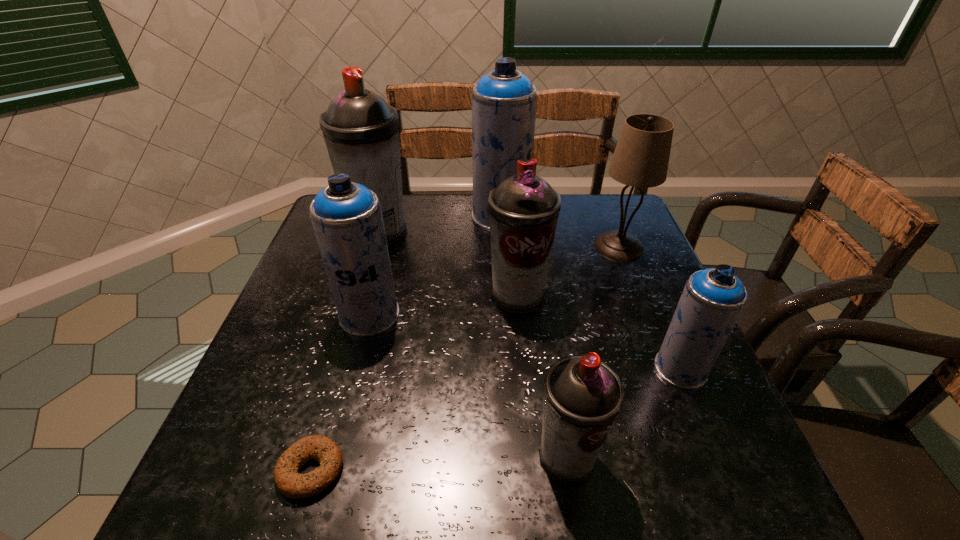
I want to click on object that is at the far right corner, so click(641, 157).

You are a GUI agent. You are given a task and a screenshot of the screen. Output one action in this format:
    pyautogui.click(x=<x>, y=<y>)
    Task: Click on the blank space at the far edge of the desktop
    This screenshot has width=960, height=540.
    Given the screenshot: What is the action you would take?
    pyautogui.click(x=467, y=227)

The image size is (960, 540). What are the coordinates of `free space at the near edge of the desktop` in the screenshot? It's located at (450, 509).

Find the location of a particular element. vacant position at the left edge of the desktop is located at coordinates (252, 407).

The width and height of the screenshot is (960, 540). I want to click on vacant space at the right edge, so click(652, 349).

Where is `vacant space at the near left corner of the desktop`? The image size is (960, 540). vacant space at the near left corner of the desktop is located at coordinates (197, 482).

Where is `vacant space at the far right corner of the desktop`? The height and width of the screenshot is (540, 960). vacant space at the far right corner of the desktop is located at coordinates tap(607, 203).

In the image, there is a desktop. Where is `vacant space at the near right corner`? vacant space at the near right corner is located at coordinates (712, 484).

Locate an element on the screen. vacant area that lies between the nearest aerosol can and the lampshade is located at coordinates (592, 352).

Image resolution: width=960 pixels, height=540 pixels. In order to click on free space between the fifth farthest aerosol can and the second farthest gray aerosol can in this screenshot , I will do click(599, 332).